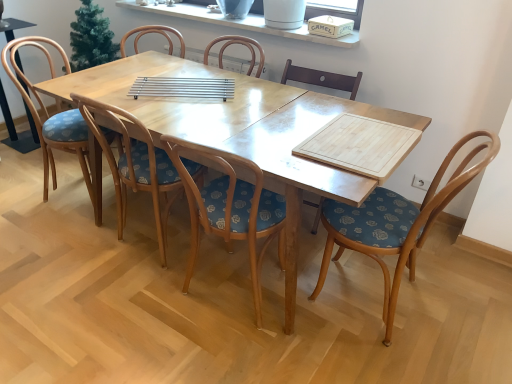
Question: Is wooden chair with floral cushion at center, the first chair from the left, to the left of woodenwoodenchair at right, which is counted as the fifth chair, starting from the left, from the viewer's perspective?

Choices:
 (A) no
 (B) yes

Answer: (B)

Question: Considering the relative sizes of wooden chair with floral cushion at center, which is the 5th chair in right-to-left order, and woodenwoodenchair at right, the 1th chair in the right-to-left sequence, in the image provided, is wooden chair with floral cushion at center, which is the 5th chair in right-to-left order, smaller than woodenwoodenchair at right, the 1th chair in the right-to-left sequence,?

Choices:
 (A) no
 (B) yes

Answer: (B)

Question: Considering the relative positions of wooden chair with floral cushion at center, which is the 5th chair in right-to-left order, and woodenwoodenchair at right, which is counted as the fifth chair, starting from the left, in the image provided, is wooden chair with floral cushion at center, which is the 5th chair in right-to-left order, in front of woodenwoodenchair at right, which is counted as the fifth chair, starting from the left,?

Choices:
 (A) no
 (B) yes

Answer: (A)

Question: Is wooden chair with floral cushion at center, the first chair from the left, positioned behind woodenwoodenchair at right, which is counted as the fifth chair, starting from the left?

Choices:
 (A) yes
 (B) no

Answer: (A)

Question: From the image's perspective, does wooden chair with floral cushion at center, the first chair from the left, appear lower than woodenwoodenchair at right, which is counted as the fifth chair, starting from the left?

Choices:
 (A) no
 (B) yes

Answer: (A)

Question: Can we say wooden chair with floral cushion at center, the first chair from the left, lies outside woodenwoodenchair at right, which is counted as the fifth chair, starting from the left?

Choices:
 (A) yes
 (B) no

Answer: (A)

Question: From the image's perspective, is wooden chair with floral upholstery at center, the 3th chair in the left-to-right sequence, located above wooden chair at left?

Choices:
 (A) no
 (B) yes

Answer: (A)

Question: Is wooden chair with floral upholstery at center, the 3th chair in the left-to-right sequence, far from wooden chair at left?

Choices:
 (A) no
 (B) yes

Answer: (B)

Question: Is wooden chair with floral upholstery at center, the 3th chair in the left-to-right sequence, to the left of wooden chair at left from the viewer's perspective?

Choices:
 (A) yes
 (B) no

Answer: (B)

Question: Could you tell me if wooden chair with floral upholstery at center, the 3th chair in the left-to-right sequence, is facing wooden chair at left?

Choices:
 (A) no
 (B) yes

Answer: (A)

Question: Is wooden chair with floral upholstery at center, the 3th chair in the left-to-right sequence, at the right side of wooden chair at left?

Choices:
 (A) yes
 (B) no

Answer: (A)

Question: Considering the relative sizes of wooden chair with floral upholstery at center, the 3th chair in the left-to-right sequence, and wooden chair at left in the image provided, is wooden chair with floral upholstery at center, the 3th chair in the left-to-right sequence, thinner than wooden chair at left?

Choices:
 (A) no
 (B) yes

Answer: (A)

Question: Considering the relative sizes of wooden chair with floral upholstery at center, the fourth chair when ordered from right to left, and wooden at center, the second chair when ordered from right to left, in the image provided, is wooden chair with floral upholstery at center, the fourth chair when ordered from right to left, bigger than wooden at center, the second chair when ordered from right to left,?

Choices:
 (A) yes
 (B) no

Answer: (A)